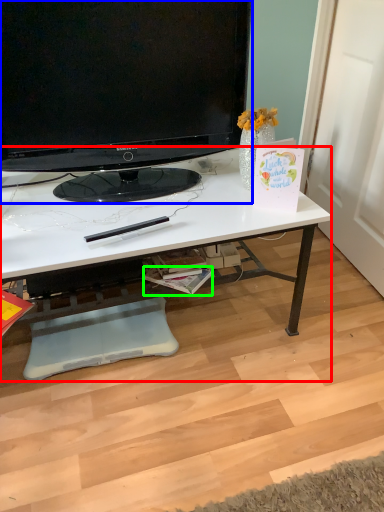
Question: Which object is positioned farthest from desk (highlighted by a red box)? Select from television (highlighted by a blue box) and magazine (highlighted by a green box).

Choices:
 (A) television
 (B) magazine

Answer: (B)